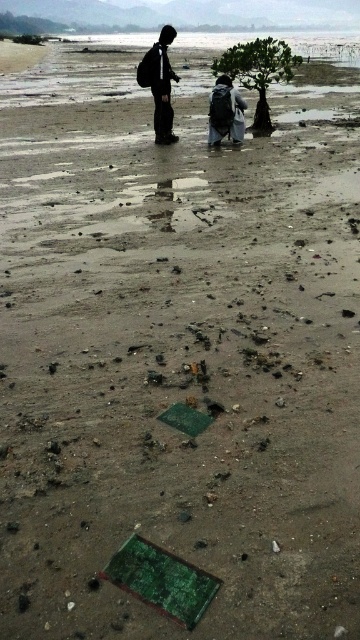
You are planning to place a picnic blanket between the green leafy tree at center and the dark gray backpack at center. Given the distance between them, will there be enough space to comfortably fit a picnic blanket that is 3 feet wide?

The green leafy tree at center is 3.50 feet away from the dark gray backpack at center. Since the distance between them is 3.50 feet, which is slightly more than the 3 feet width of the picnic blanket, there should be enough space to comfortably fit it between them.

You are planning to take a photo of the green leafy tree at center and the black matte backpack at upper center. Which object should you focus on first if you want to capture both in a single frame without moving the camera?

The green leafy tree at center is bigger than the black matte backpack at upper center, so you should focus on the green leafy tree at center first to ensure it fills the frame appropriately before adjusting for the smaller backpack.